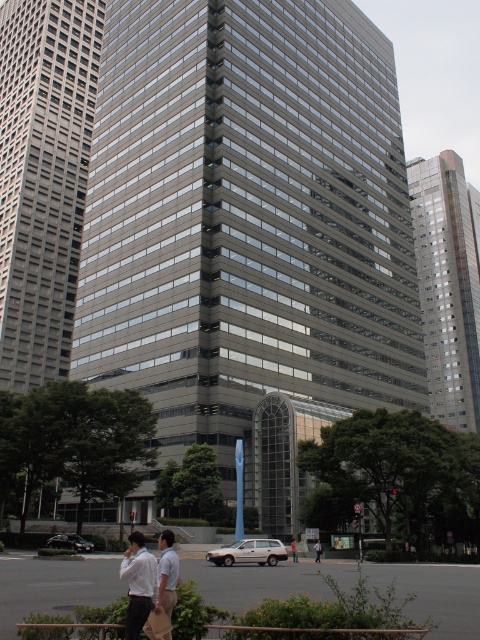
You are a photographer standing in front of the metallic glass skyscraper at center and the white shirt at lower center. You want to capture both in a single photo. Which object should you focus on first to ensure both are in frame?

The metallic glass skyscraper at center is much taller than the white shirt at lower center, so you should focus on the metallic glass skyscraper at center first to ensure both fit within the frame.

You are standing at the point with coordinates 0.5, 0.9 in the image. You want to walk towards the metallic glass skyscraper at center. In which direction should you move?

You should move towards the left because the metallic glass skyscraper at center is located at point (447, 284), which is to the left of your current position at (432, 320).

You are a city planner reviewing the urban layout. You need to determine if the gray glass building at center can be seen from the entrance of the metallic glass skyscraper at center. Based on their heights, what is your assessment?

The gray glass building at center is shorter than the metallic glass skyscraper at center, so the metallic glass skyscraper at center would likely block the view of the gray glass building at center from its entrance.